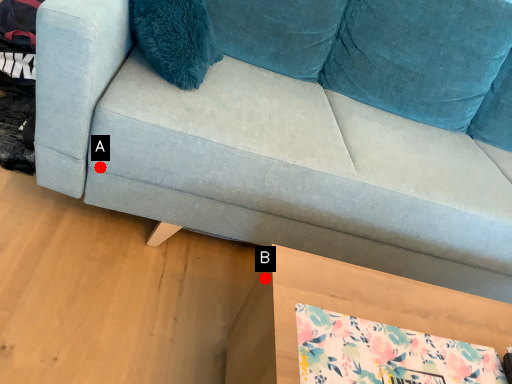
Question: Two points are circled on the image, labeled by A and B beside each circle. Which point is closer to the camera?

Choices:
 (A) A is closer
 (B) B is closer

Answer: (B)